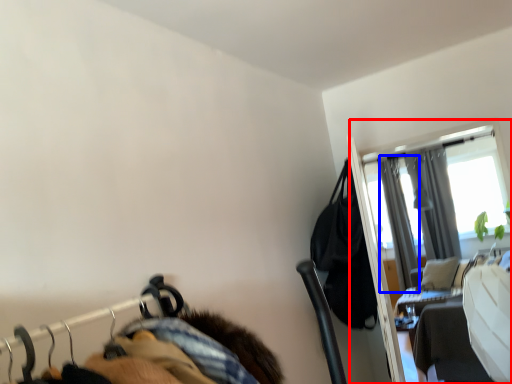
Question: Which of the following is the farthest to the observer, screen door (highlighted by a red box) or curtain (highlighted by a blue box)?

Choices:
 (A) screen door
 (B) curtain

Answer: (B)